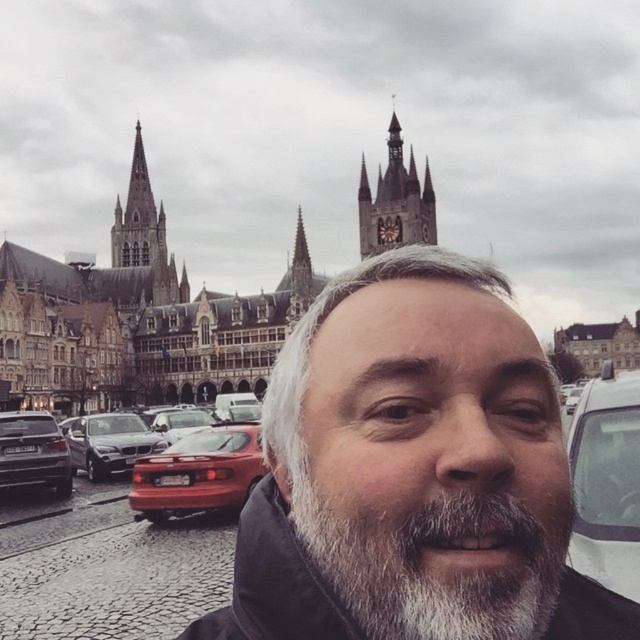
Who is more distant from viewer, (125,225) or (116,413)?

Positioned behind is point (125,225).

Between point (129, 196) and point (106, 460), which one is positioned in front?

Point (106, 460) is in front.

I want to click on dark gray stone tower at upper left, so click(x=145, y=236).

Who is positioned more to the left, gray hair at center or golden stone clock tower at upper center?

gray hair at center is more to the left.

In order to click on gray hair at center in this screenshot , I will do `click(412, 472)`.

This screenshot has width=640, height=640. What do you see at coordinates (412, 472) in the screenshot?
I see `gray hair at center` at bounding box center [412, 472].

Identify the location of gray hair at center. (412, 472).

From the picture: Who is lower down, golden stone clock tower at upper center or shiny silver sedan at left?

Positioned lower is shiny silver sedan at left.

Can you confirm if golden stone clock tower at upper center is positioned below shiny silver sedan at left?

Actually, golden stone clock tower at upper center is above shiny silver sedan at left.

Is point (396, 220) positioned behind point (67, 480)?

Yes.

Identify the location of golden stone clock tower at upper center. (396, 202).